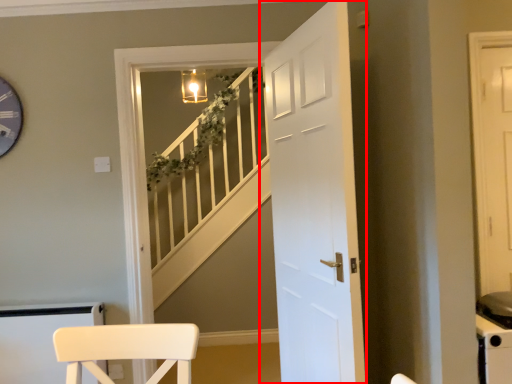
Question: From the image's perspective, what is the correct spatial relationship of door (annotated by the red box) in relation to stairwell?

Choices:
 (A) above
 (B) below

Answer: (A)